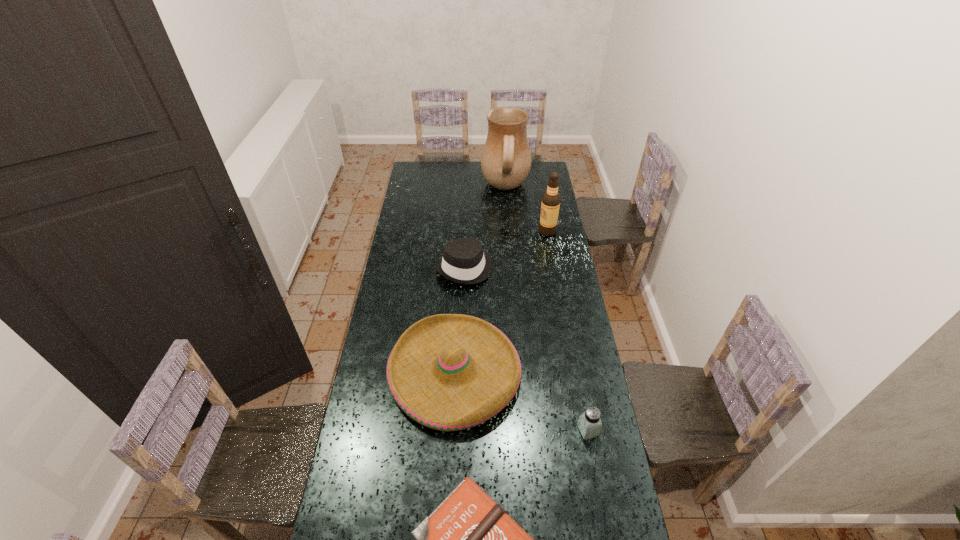
Find the location of a particular element. cream pitcher is located at coordinates (506, 159).

The image size is (960, 540). What are the coordinates of `the tallest object` in the screenshot? It's located at (506, 159).

Where is `the fifth shortest object`? Image resolution: width=960 pixels, height=540 pixels. the fifth shortest object is located at coordinates (550, 204).

The height and width of the screenshot is (540, 960). What are the coordinates of `alcohol` in the screenshot? It's located at (550, 204).

This screenshot has height=540, width=960. Find the location of `the fourth nearest object`. the fourth nearest object is located at coordinates (464, 262).

Locate an element on the screen. sombrero is located at coordinates (449, 372).

Locate an element on the screen. This screenshot has width=960, height=540. saltshaker is located at coordinates (589, 423).

Locate an element on the screen. free spot located at the spout of the farthest object is located at coordinates (419, 188).

Locate an element on the screen. The height and width of the screenshot is (540, 960). vacant area located at the spout of the farthest object is located at coordinates (434, 188).

Where is `free space located 0.230m at the spout of the farthest object`? free space located 0.230m at the spout of the farthest object is located at coordinates pos(442,188).